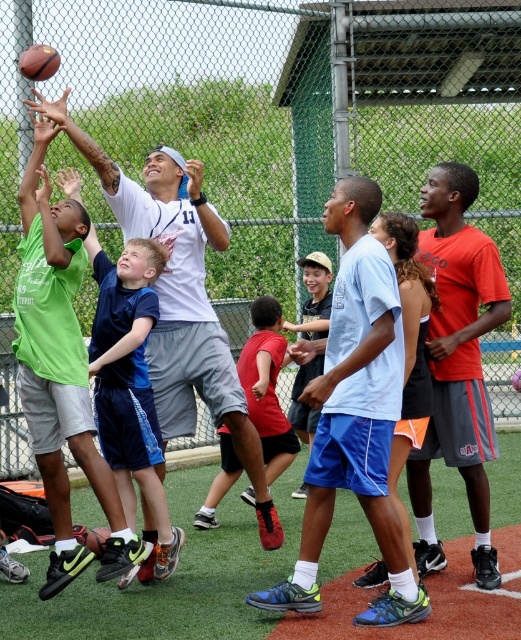
You are a photographer trying to capture a photo of the red matte shirt at center and the red shirt at center. Which one should you zoom in on to ensure it appears larger in the photo?

The red matte shirt at center is wider than the red shirt at center, so you should zoom in on the red matte shirt at center to make it appear larger in the photo.

You are a photographer trying to capture a closeup of the light blue shorts at center and the rubber textured basketball at upper left. Which object should you zoom in on to get a clearer image?

The light blue shorts at center is bigger than the rubber textured basketball at upper left, so zooming in on the light blue shorts at center will provide a clearer image since it is larger.